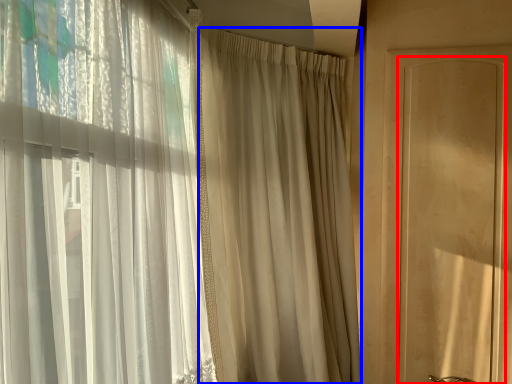
Question: Which of the following is the farthest to the observer, screen door (highlighted by a red box) or curtain (highlighted by a blue box)?

Choices:
 (A) screen door
 (B) curtain

Answer: (A)